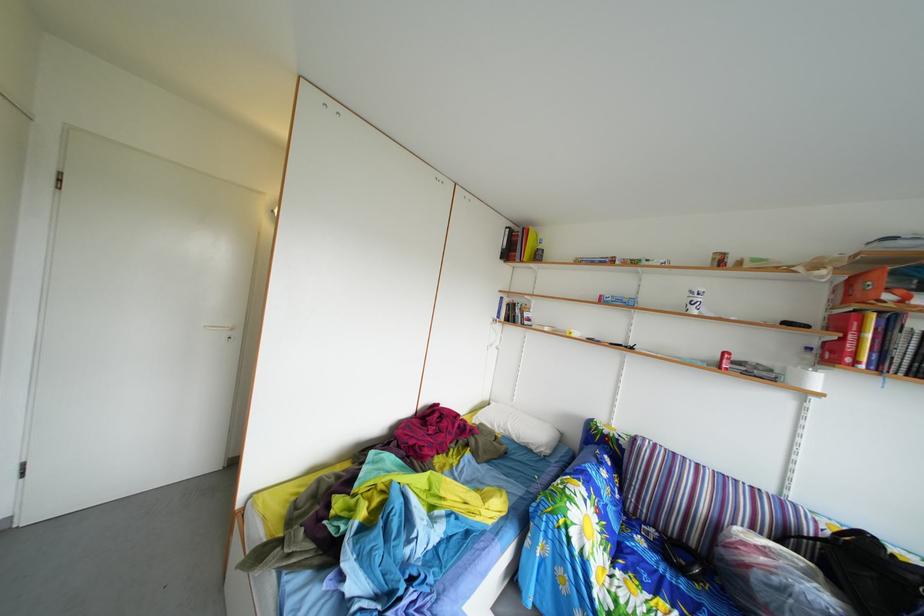
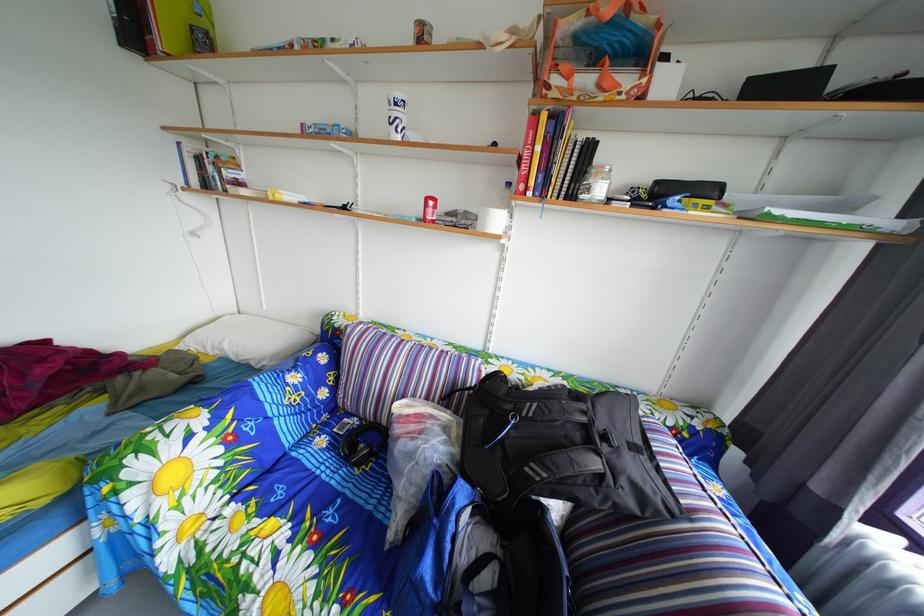
Find the pixel in the second image that matches the point at 660,582 in the first image.

(301, 493)